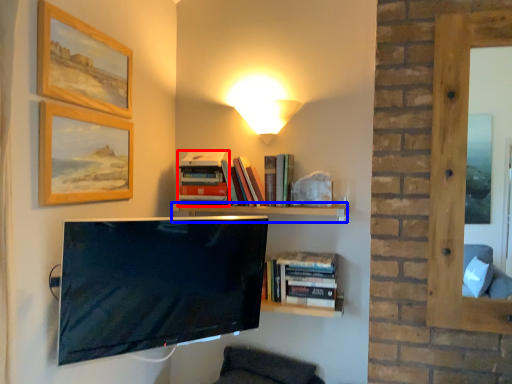
Question: Which object is further to the camera taking this photo, book (highlighted by a red box) or shelf (highlighted by a blue box)?

Choices:
 (A) book
 (B) shelf

Answer: (A)